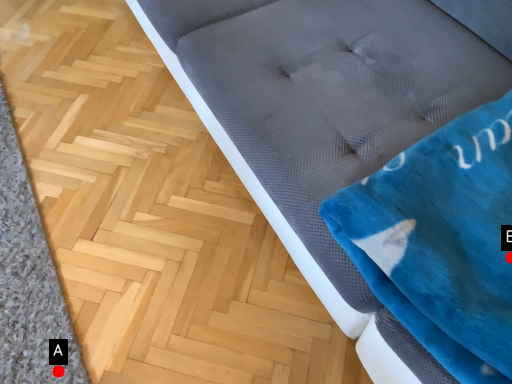
Question: Two points are circled on the image, labeled by A and B beside each circle. Which of the following is the closest to the observer?

Choices:
 (A) A is closer
 (B) B is closer

Answer: (B)